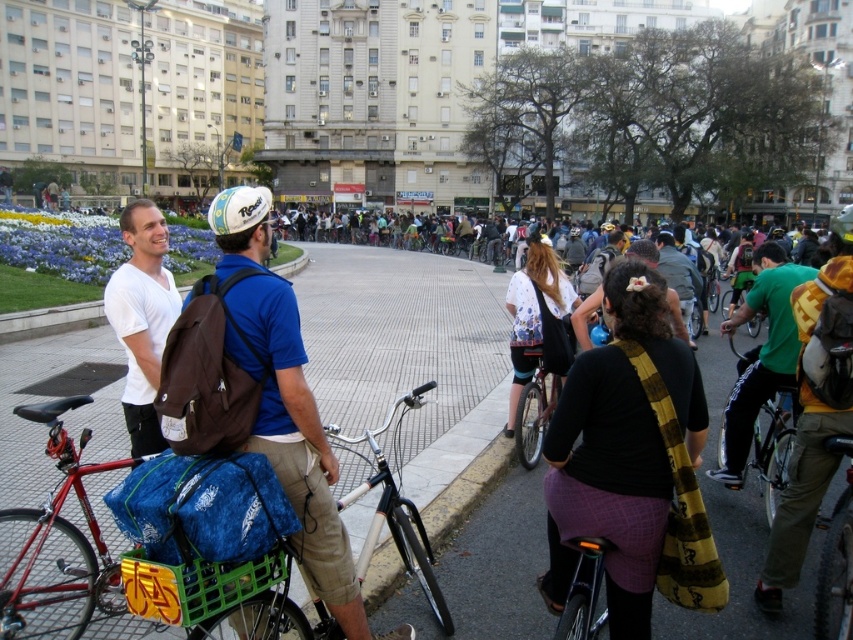
Question: Can you confirm if brown fabric backpack at center is positioned above green fabric backpack at right?

Choices:
 (A) no
 (B) yes

Answer: (A)

Question: Can you confirm if shiny black bicycle at lower center is wider than white matte bicycle helmet at upper center?

Choices:
 (A) yes
 (B) no

Answer: (B)

Question: Which object is positioned closest to the shiny metallic bicycle at lower right?

Choices:
 (A) shiny black bicycle at center-right
 (B) white matte bicycle helmet at upper center
 (C) shiny silver bicycle at center

Answer: (A)

Question: Which object is the farthest from the silver metallic bicycle at center?

Choices:
 (A) dark gray backpack at center
 (B) white matte t-shirt at center
 (C) white matte bicycle helmet at upper center

Answer: (A)

Question: Is white matte t-shirt at center above green fabric backpack at right?

Choices:
 (A) yes
 (B) no

Answer: (A)

Question: Among these objects, which one is farthest from the camera?

Choices:
 (A) green matte bicycle helmet at center
 (B) brown fabric backpack at center

Answer: (A)